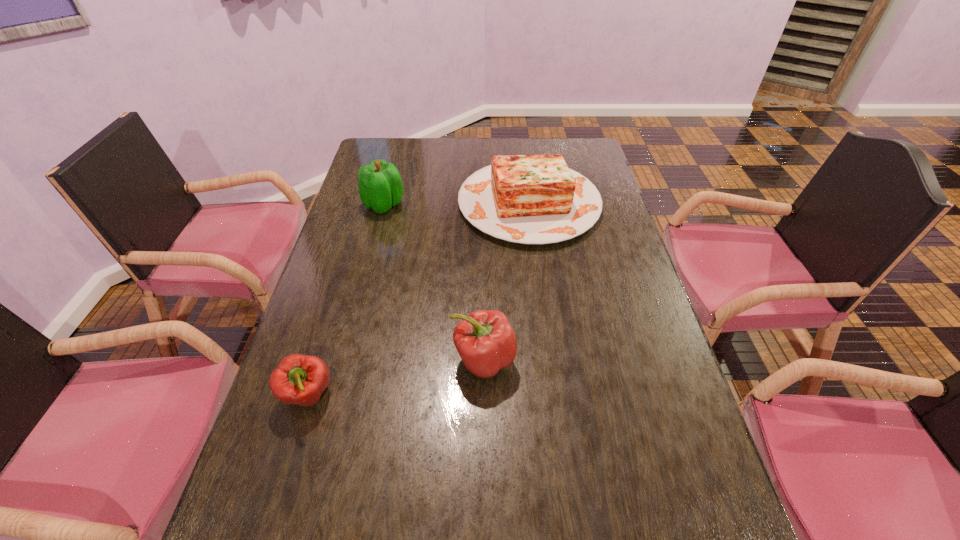
Where is `the farthest bell pepper`? the farthest bell pepper is located at coordinates (380, 186).

The height and width of the screenshot is (540, 960). What are the coordinates of `the rightmost bell pepper` in the screenshot? It's located at (486, 342).

Where is `lasagna`? Image resolution: width=960 pixels, height=540 pixels. lasagna is located at coordinates (530, 199).

Locate an element on the screen. The width and height of the screenshot is (960, 540). the shortest object is located at coordinates (299, 379).

Identify the location of free point located 0.250m on the back of the farthest bell pepper. The image size is (960, 540). (396, 156).

At what (x,y) coordinates should I click in order to perform the action: click on vacant space located on the left of the rightmost bell pepper. Please return your answer as a coordinate pair (x, y). Looking at the image, I should click on click(x=397, y=360).

Find the location of a particular element. The height and width of the screenshot is (540, 960). free space located 0.360m on the front of the lasagna is located at coordinates (548, 347).

Where is `free space located on the back of the shortest object`? This screenshot has height=540, width=960. free space located on the back of the shortest object is located at coordinates (342, 284).

The height and width of the screenshot is (540, 960). In order to click on object present at the far edge in this screenshot , I will do `click(530, 199)`.

I want to click on object present at the right edge, so click(x=530, y=199).